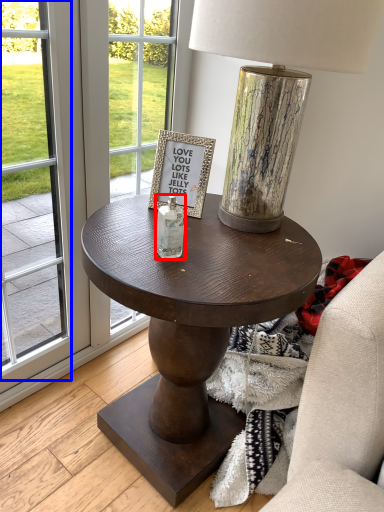
Question: Which of the following is the farthest to the observer, bottle (highlighted by a red box) or screen door (highlighted by a blue box)?

Choices:
 (A) bottle
 (B) screen door

Answer: (A)